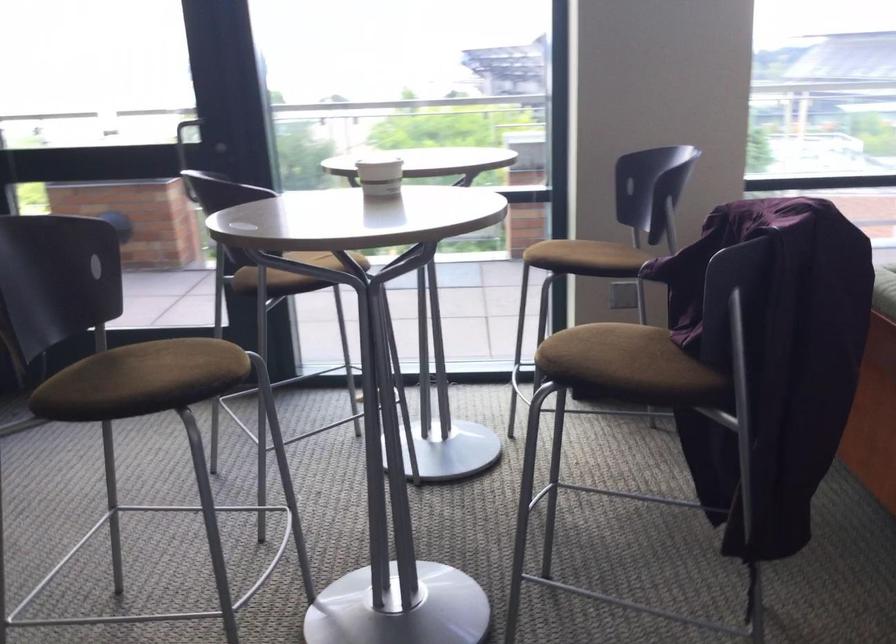
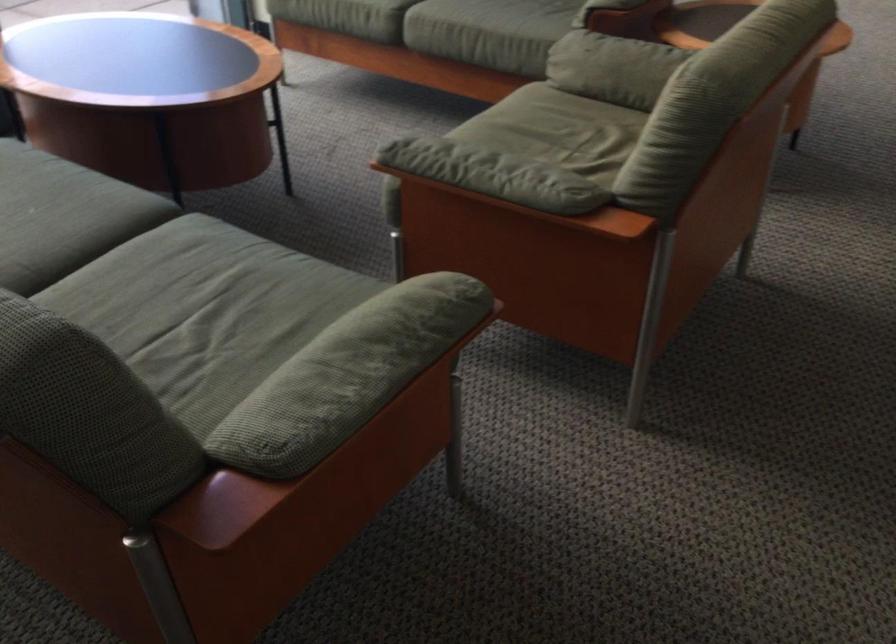
Based on the continuous images, in which direction is the camera rotating?

The rotation direction of the camera is right-down.